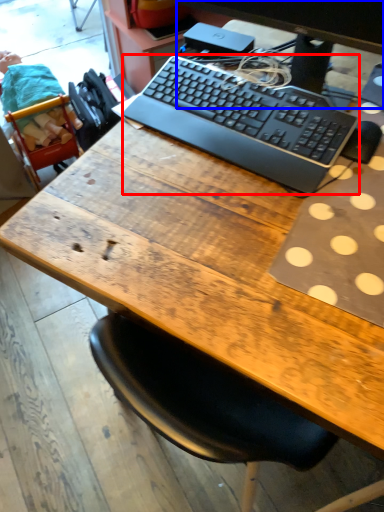
Question: Which of the following is the closest to the observer, computer keyboard (highlighted by a red box) or computer monitor (highlighted by a blue box)?

Choices:
 (A) computer keyboard
 (B) computer monitor

Answer: (B)